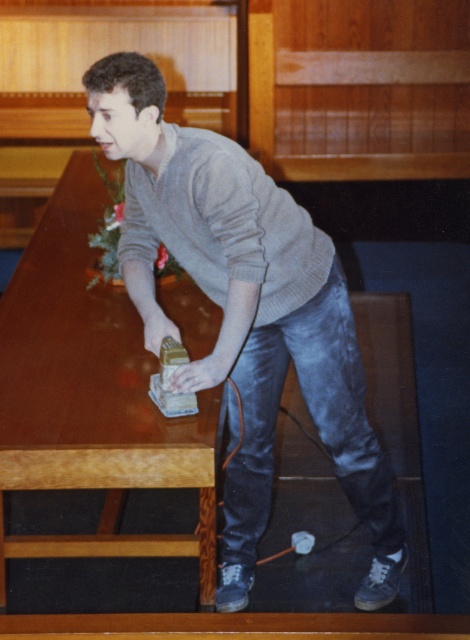
Who is more forward, (280, 292) or (86, 204)?

Point (280, 292)

Which is above, gray wool sweater at center or shiny brown wood table at center?

shiny brown wood table at center is higher up.

Where is `gray wool sweater at center`? The height and width of the screenshot is (640, 470). gray wool sweater at center is located at coordinates (244, 310).